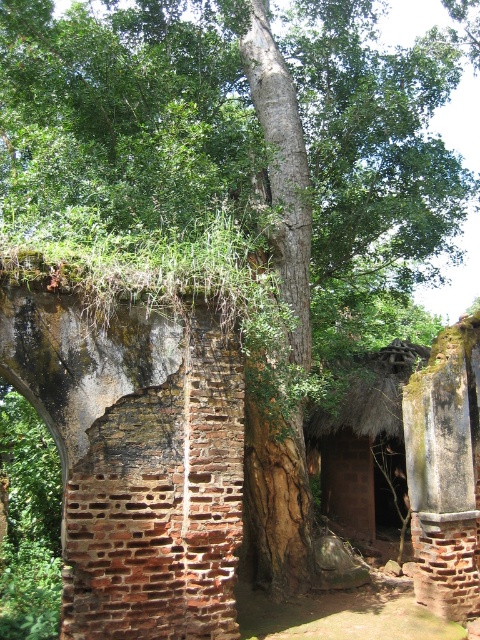
You are an explorer standing in front of the old ruined structure. You notice the rusty brick wall at center and the thatched roof hut at center. Which object is closer to you?

The rusty brick wall at center is closer to you because it is in front of the thatched roof hut at center.

Looking at this image, you are standing at the entrance of the old ruined building and see the point marked at coordinates (134, 456). What does this point indicate?

The point at coordinates (134, 456) marks the location of the rusty brick wall at center.

You are an architect assessing the stability of the rusty brick wall at center and the thatched roof hut at center in the image. Which structure takes up more area in the scene?

The thatched roof hut at center occupies more space than the rusty brick wall at center, so it takes up more area in the scene.